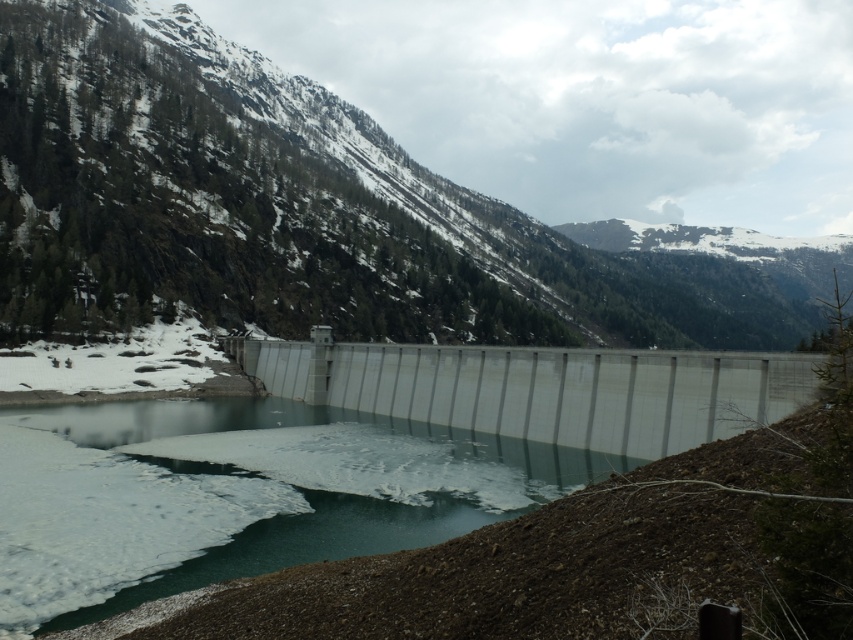
You are standing at the base of the snowy forested mountain at upper center and want to cross to the other side of the gray concrete dam at center. Can you see the dam from your current position?

The gray concrete dam at center is behind the snowy forested mountain at upper center, so you cannot see the dam from your current position at the base of the mountain.

You are a construction worker planning to place a 100 meter long crane between the snowy forested mountain at upper center and the gray concrete dam at center. Can the crane fit in the space between them?

The distance between the snowy forested mountain at upper center and the gray concrete dam at center is 150.58 meters, so the 100 meter long crane can fit in the space between them since it is shorter than the available distance.

You are a photographer standing at the base of the dam and want to capture both the snowy forested mountain at upper center and the translucent ice at center in your photo. Which object will appear closer to the camera in the final image?

The snowy forested mountain at upper center will appear closer to the camera because it is in front of the translucent ice at center.